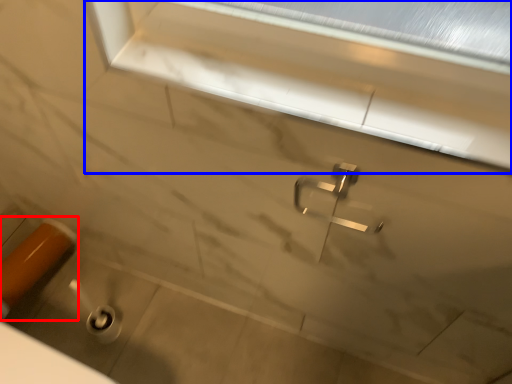
Question: Which point is further to the camera, door handle (highlighted by a red box) or window frame (highlighted by a blue box)?

Choices:
 (A) door handle
 (B) window frame

Answer: (A)